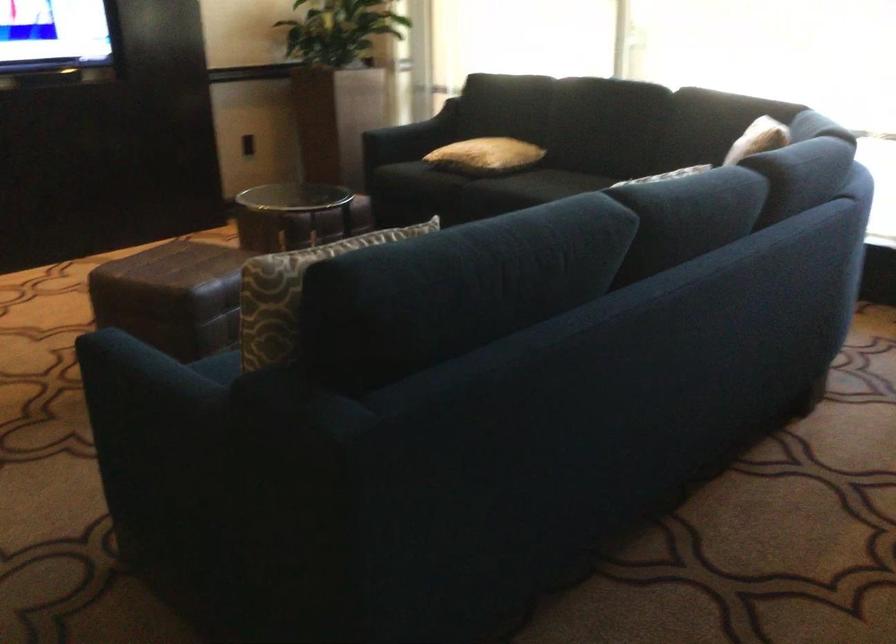
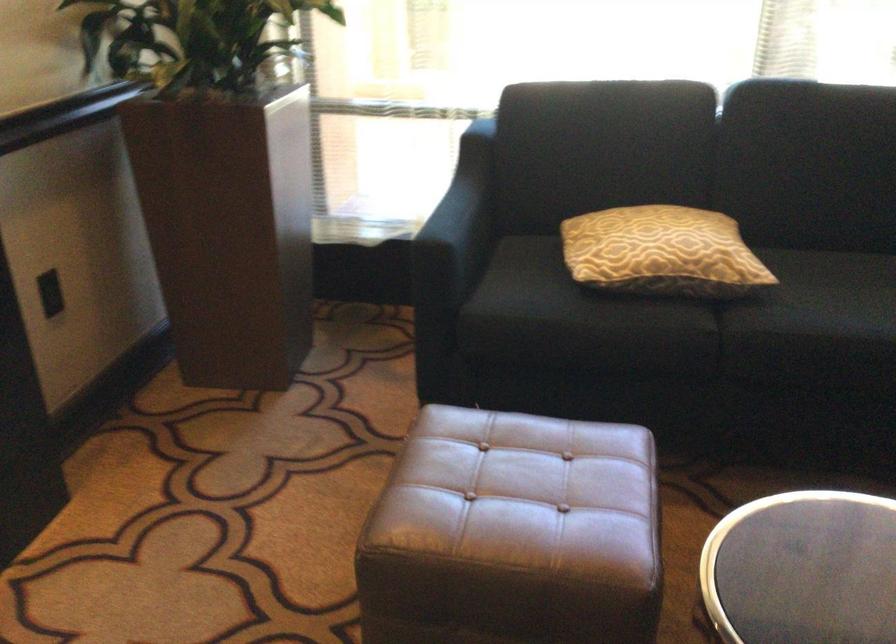
Where in the second image is the point corresponding to point (495, 172) from the first image?

(752, 289)